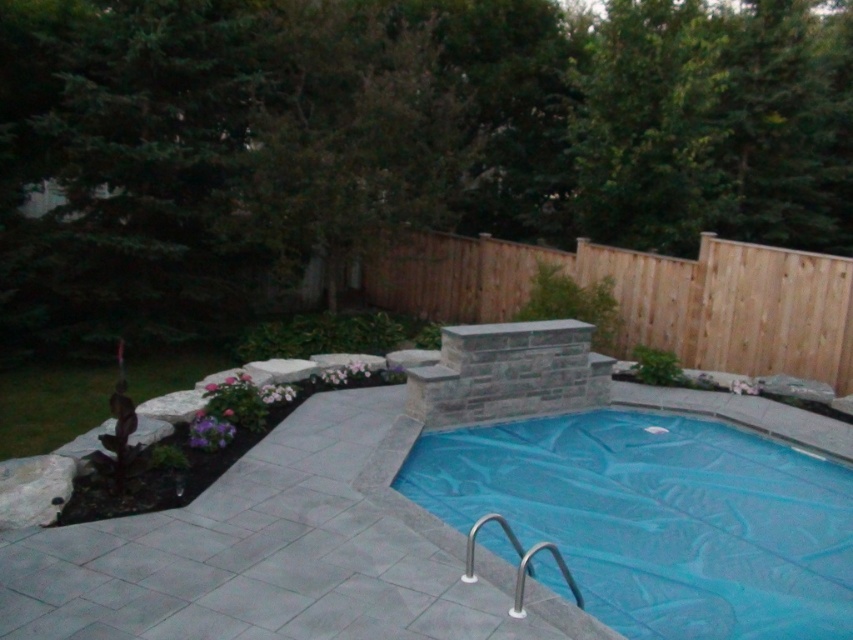
Question: Among these objects, which one is farthest from the camera?

Choices:
 (A) blue plastic pool at center
 (B) brown wood fence at center

Answer: (B)

Question: Is blue plastic pool at center closer to the viewer compared to brown wood fence at center?

Choices:
 (A) yes
 (B) no

Answer: (A)

Question: Is blue plastic pool at center bigger than brown wood fence at center?

Choices:
 (A) yes
 (B) no

Answer: (A)

Question: Is blue plastic pool at center to the right of brown wood fence at center from the viewer's perspective?

Choices:
 (A) no
 (B) yes

Answer: (B)

Question: Which point is farther to the camera?

Choices:
 (A) (477, 256)
 (B) (538, 538)

Answer: (A)